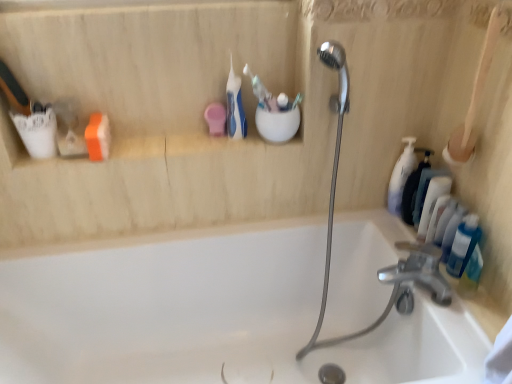
Question: Is white glossy bathtub at center oriented towards white matte pump bottle at right, which is counted as the 5th toiletry, starting from the right?

Choices:
 (A) no
 (B) yes

Answer: (A)

Question: From a real-world perspective, does white glossy bathtub at center sit lower than white matte pump bottle at right, the first toiletry viewed from the left?

Choices:
 (A) yes
 (B) no

Answer: (A)

Question: Is there a large distance between white glossy bathtub at center and white matte pump bottle at right, the first toiletry viewed from the left?

Choices:
 (A) no
 (B) yes

Answer: (A)

Question: Does white glossy bathtub at center have a smaller size compared to white matte pump bottle at right, the first toiletry viewed from the left?

Choices:
 (A) yes
 (B) no

Answer: (B)

Question: From a real-world perspective, is white glossy bathtub at center located higher than white matte pump bottle at right, which is counted as the 5th toiletry, starting from the right?

Choices:
 (A) no
 (B) yes

Answer: (A)

Question: Relative to translucent plastic toothbrush at upper center, acting as the first toothbrush starting from the right, is blue plastic toothbrush at upper center, the second toothbrush in the right-to-left sequence, in front or behind?

Choices:
 (A) front
 (B) behind

Answer: (A)

Question: In terms of size, does blue plastic toothbrush at upper center, the second toothbrush in the right-to-left sequence, appear bigger or smaller than translucent plastic toothbrush at upper center, positioned as the 3th toothbrush in left-to-right order?

Choices:
 (A) big
 (B) small

Answer: (A)

Question: Based on their positions, is blue plastic toothbrush at upper center, the second toothbrush in the right-to-left sequence, located to the left or right of translucent plastic toothbrush at upper center, positioned as the 3th toothbrush in left-to-right order?

Choices:
 (A) left
 (B) right

Answer: (A)

Question: In terms of width, does blue plastic toothbrush at upper center, the second toothbrush in the right-to-left sequence, look wider or thinner when compared to translucent plastic toothbrush at upper center, acting as the first toothbrush starting from the right?

Choices:
 (A) thin
 (B) wide

Answer: (B)

Question: Do you think white glossy bathtub at center is within white glossy soap dispenser at right, the fourth toiletry from the right, or outside of it?

Choices:
 (A) inside
 (B) outside

Answer: (B)

Question: From the image's perspective, is white glossy bathtub at center positioned above or below white glossy soap dispenser at right, the fourth toiletry from the right?

Choices:
 (A) above
 (B) below

Answer: (B)

Question: From a real-world perspective, is white glossy bathtub at center positioned above or below white glossy soap dispenser at right, acting as the second toiletry starting from the left?

Choices:
 (A) above
 (B) below

Answer: (B)

Question: In terms of size, does white glossy bathtub at center appear bigger or smaller than white glossy soap dispenser at right, the fourth toiletry from the right?

Choices:
 (A) small
 (B) big

Answer: (B)

Question: Is white glossy bathtub at center wider or thinner than blue translucent bottle at right, which is the 2th toiletry from right to left?

Choices:
 (A) thin
 (B) wide

Answer: (B)

Question: In terms of size, does white glossy bathtub at center appear bigger or smaller than blue translucent bottle at right, the fourth toiletry when ordered from left to right?

Choices:
 (A) small
 (B) big

Answer: (B)